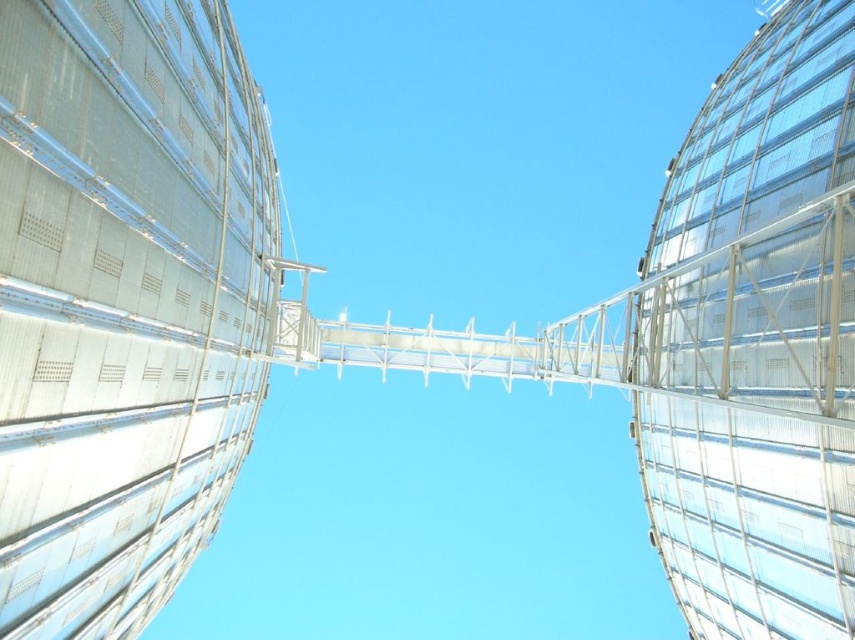
Identify the location of metallic silver tower at left. The height and width of the screenshot is (640, 855). (124, 301).

Is metallic silver tower at left positioned before transparent glass tower at right?

Yes, metallic silver tower at left is in front of transparent glass tower at right.

Does point (177, 227) come closer to viewer compared to point (783, 632)?

That is True.

The image size is (855, 640). I want to click on metallic silver tower at left, so click(124, 301).